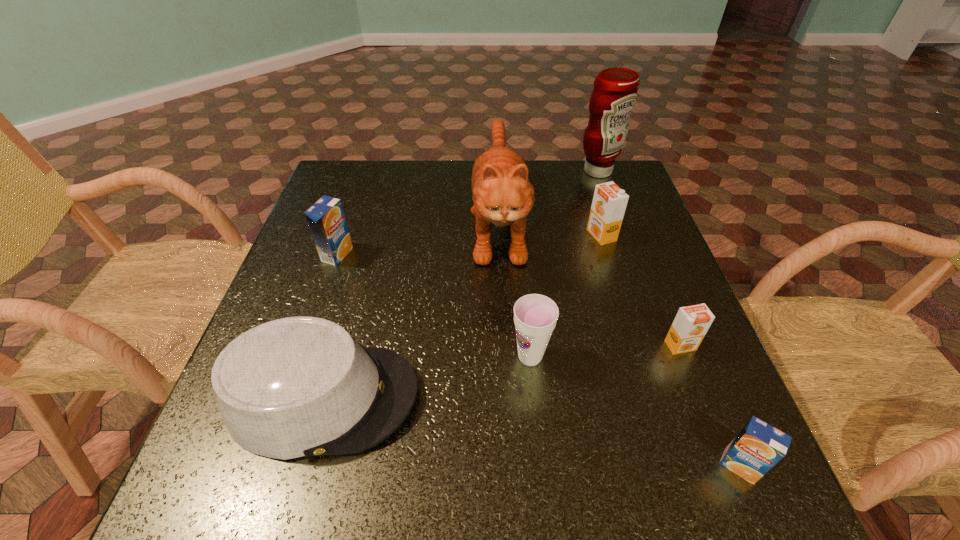
The image size is (960, 540). What are the coordinates of `free spot between the nearest orange juice and the right orange orange juice` in the screenshot? It's located at (709, 406).

This screenshot has width=960, height=540. Find the location of `vacant area between the hat and the orange cat`. vacant area between the hat and the orange cat is located at coordinates (411, 310).

You are a GUI agent. You are given a task and a screenshot of the screen. Output one action in this format:
    pyautogui.click(x=<x>, y=<y>)
    Task: Click on the free space between the hat and the orange cat
    The width and height of the screenshot is (960, 540).
    Given the screenshot: What is the action you would take?
    pyautogui.click(x=411, y=310)

The height and width of the screenshot is (540, 960). Identify the location of empty location between the smaller orange orange juice and the cup. tap(605, 351).

The height and width of the screenshot is (540, 960). I want to click on unoccupied area between the purple cup and the cat, so click(515, 290).

In order to click on empty space between the right orange orange juice and the purple cup in this screenshot , I will do `click(605, 351)`.

Identify which object is the nearest to the left blue orange_juice. Please provide its 2D coordinates. Your answer should be formatted as a tuple, i.e. [(x, y)], where the tuple contains the x and y coordinates of a point satisfying the conditions above.

[(296, 387)]

Image resolution: width=960 pixels, height=540 pixels. I want to click on object that is the closest to the condiment, so click(502, 194).

Identify which orange juice is the nearest to the hat. Please provide its 2D coordinates. Your answer should be formatted as a tuple, i.e. [(x, y)], where the tuple contains the x and y coordinates of a point satisfying the conditions above.

[(326, 219)]

Locate an element on the screen. The height and width of the screenshot is (540, 960). orange juice that is the closest one to the right blue orange_juice is located at coordinates (691, 323).